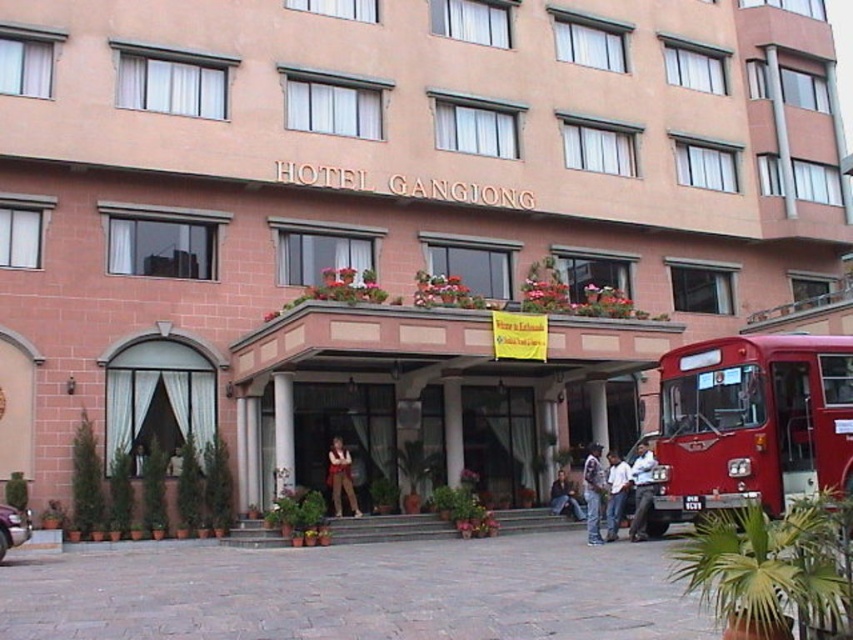
You are standing at the entrance of Hotel Ganglong and see a red metallic bus at right and a light brown leather jacket at lower right. Which object is bigger?

The red metallic bus at right is larger in size than the light brown leather jacket at lower right.

You are standing at the entrance of Hotel Ganglong and see a denim jacket at lower right. Where exactly is the denim jacket positioned relative to the entrance?

The denim jacket at lower right is located at point 0.770 on the x axis and 0.696 on the y axis relative to the entrance.